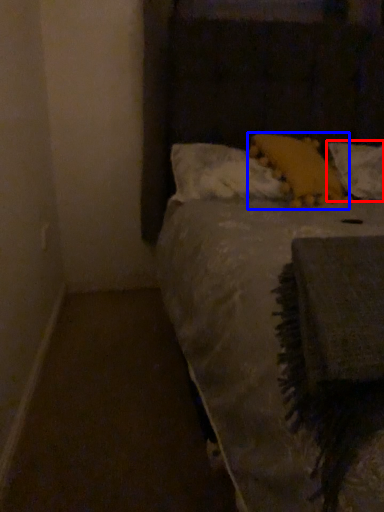
Question: Which object is further to the camera taking this photo, pillow (highlighted by a red box) or pillow (highlighted by a blue box)?

Choices:
 (A) pillow
 (B) pillow

Answer: (A)